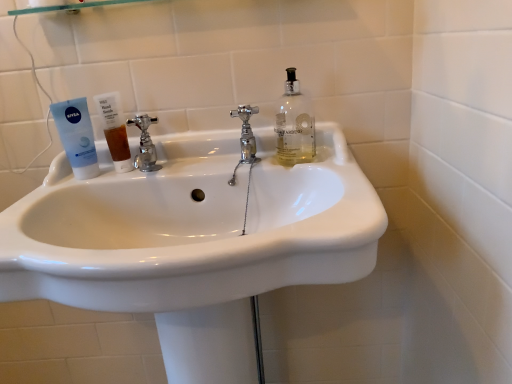
Question: Which direction should I rotate to look at polished chrome faucet at center, the 2th tap in the right-to-left sequence?

Choices:
 (A) left
 (B) right

Answer: (A)

Question: Is white glossy sink at center next to blue matte tube at left and touching it?

Choices:
 (A) no
 (B) yes

Answer: (A)

Question: Can you confirm if white glossy sink at center is taller than blue matte tube at left?

Choices:
 (A) no
 (B) yes

Answer: (B)

Question: Is white glossy sink at center at the right side of blue matte tube at left?

Choices:
 (A) yes
 (B) no

Answer: (A)

Question: Considering the relative sizes of white glossy sink at center and blue matte tube at left in the image provided, is white glossy sink at center shorter than blue matte tube at left?

Choices:
 (A) yes
 (B) no

Answer: (B)

Question: Is white glossy sink at center wider than blue matte tube at left?

Choices:
 (A) yes
 (B) no

Answer: (A)

Question: Is white glossy sink at center at the left side of blue matte tube at left?

Choices:
 (A) yes
 (B) no

Answer: (B)

Question: Can you confirm if polished chrome faucet at center, acting as the 2th tap starting from the left, is wider than blue matte tube at left?

Choices:
 (A) no
 (B) yes

Answer: (A)

Question: Would you consider polished chrome faucet at center, acting as the 2th tap starting from the left, to be distant from blue matte tube at left?

Choices:
 (A) yes
 (B) no

Answer: (B)

Question: Is polished chrome faucet at center, arranged as the 1th tap when viewed from the right, positioned behind blue matte tube at left?

Choices:
 (A) no
 (B) yes

Answer: (B)

Question: From a real-world perspective, is polished chrome faucet at center, arranged as the 1th tap when viewed from the right, under blue matte tube at left?

Choices:
 (A) yes
 (B) no

Answer: (A)

Question: Is polished chrome faucet at center, acting as the 2th tap starting from the left, beside blue matte tube at left?

Choices:
 (A) yes
 (B) no

Answer: (B)

Question: Could you tell me if polished chrome faucet at center, arranged as the 1th tap when viewed from the right, is facing blue matte tube at left?

Choices:
 (A) no
 (B) yes

Answer: (A)

Question: Does brown translucent liquid at sink left lie behind polished chrome faucet at center, the 2th tap in the right-to-left sequence?

Choices:
 (A) no
 (B) yes

Answer: (B)